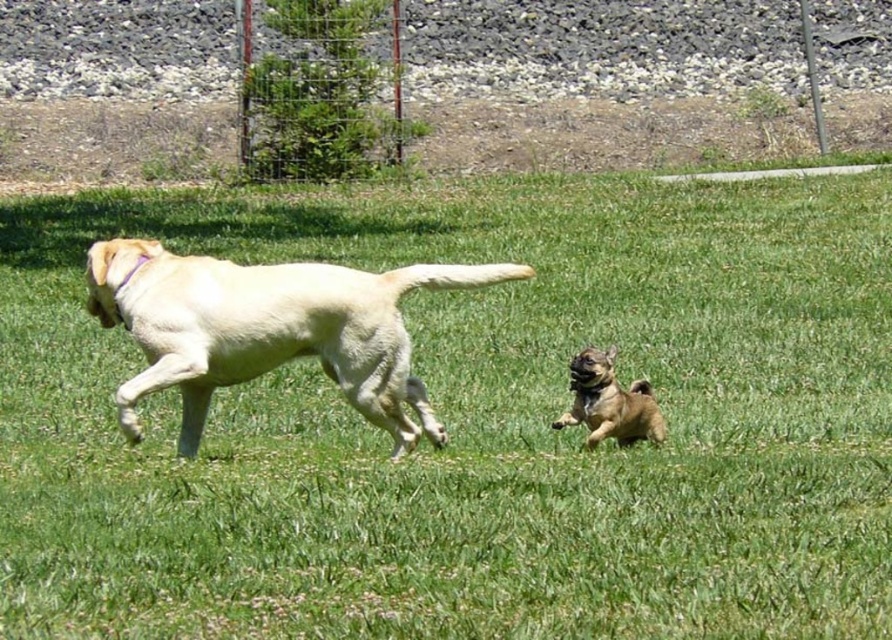
Question: Which point is farther from the camera taking this photo?

Choices:
 (A) (791, 451)
 (B) (593, 445)
 (C) (386, 406)

Answer: (A)

Question: Is light yellow fur at center to the left of brown furry dog at center from the viewer's perspective?

Choices:
 (A) yes
 (B) no

Answer: (A)

Question: Which is nearer to the light yellow fur at center?

Choices:
 (A) brown furry dog at center
 (B) green grass at center

Answer: (A)

Question: Can you confirm if green grass at center is positioned below light yellow fur at center?

Choices:
 (A) yes
 (B) no

Answer: (B)

Question: Among these objects, which one is farthest from the camera?

Choices:
 (A) green grass at center
 (B) brown furry dog at center
 (C) light yellow fur at center

Answer: (B)

Question: Can you confirm if light yellow fur at center is positioned below brown furry dog at center?

Choices:
 (A) no
 (B) yes

Answer: (A)